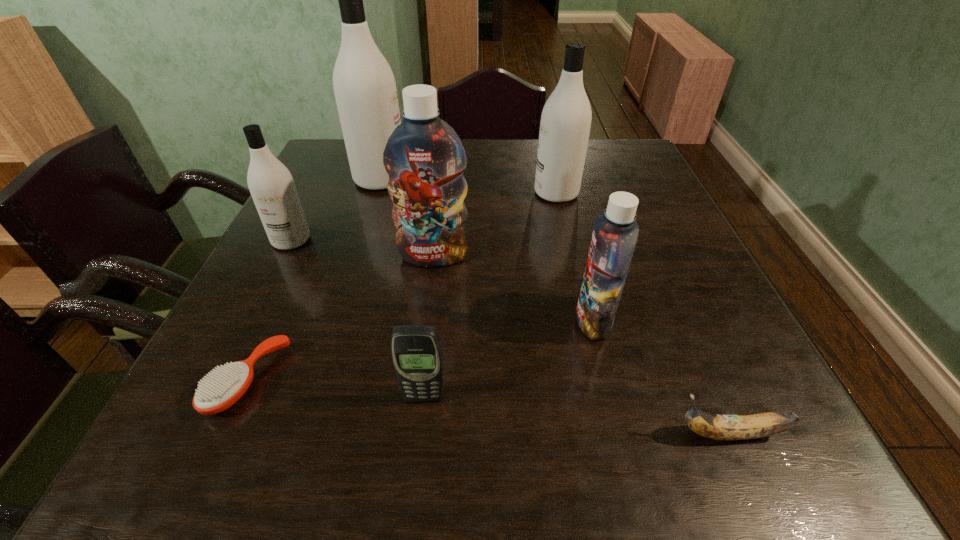
The image size is (960, 540). I want to click on the tallest object, so click(x=365, y=89).

In order to click on the second shampoo from left to right in this screenshot , I will do `click(365, 89)`.

The height and width of the screenshot is (540, 960). In order to click on the second biggest white shampoo in this screenshot , I will do `click(565, 123)`.

Locate an element on the screen. The width and height of the screenshot is (960, 540). the bigger blue shampoo is located at coordinates (425, 159).

Locate an element on the screen. The height and width of the screenshot is (540, 960). the farther blue shampoo is located at coordinates (425, 159).

The width and height of the screenshot is (960, 540). I want to click on the nearer blue shampoo, so click(615, 234).

The image size is (960, 540). Identify the location of the fifth farthest object. (615, 234).

Image resolution: width=960 pixels, height=540 pixels. What are the coordinates of `the leftmost white shampoo` in the screenshot? It's located at (270, 183).

Identify the location of the smallest white shampoo. The image size is (960, 540). (270, 183).

You are a GUI agent. You are given a task and a screenshot of the screen. Output one action in this format:
    pyautogui.click(x=<x>, y=<y>)
    Task: Click on the cellular telephone
    This screenshot has height=540, width=960.
    Given the screenshot: What is the action you would take?
    pyautogui.click(x=416, y=351)